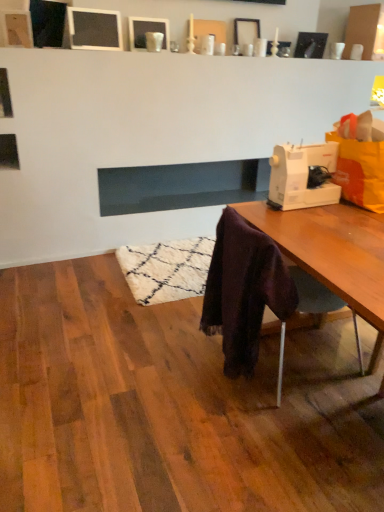
Question: From a real-world perspective, is dark glass fireplace at center physically above white plastic sewing machine at right?

Choices:
 (A) no
 (B) yes

Answer: (A)

Question: Is dark glass fireplace at center further to camera compared to white plastic sewing machine at right?

Choices:
 (A) yes
 (B) no

Answer: (A)

Question: Is dark glass fireplace at center to the right of white plastic sewing machine at right from the viewer's perspective?

Choices:
 (A) yes
 (B) no

Answer: (B)

Question: Does dark glass fireplace at center have a greater width compared to white plastic sewing machine at right?

Choices:
 (A) yes
 (B) no

Answer: (A)

Question: Is white plastic sewing machine at right at the back of dark glass fireplace at center?

Choices:
 (A) no
 (B) yes

Answer: (A)

Question: In terms of height, does dark glass fireplace at center look taller or shorter compared to matte white picture frame at upper center, which appears as the second picture frame when viewed from the right?

Choices:
 (A) short
 (B) tall

Answer: (B)

Question: Looking at the image, does dark glass fireplace at center seem bigger or smaller compared to matte white picture frame at upper center, positioned as the third picture frame in left-to-right order?

Choices:
 (A) big
 (B) small

Answer: (A)

Question: Visually, is dark glass fireplace at center positioned to the left or to the right of matte white picture frame at upper center, which appears as the second picture frame when viewed from the right?

Choices:
 (A) right
 (B) left

Answer: (B)

Question: Looking at their shapes, would you say dark glass fireplace at center is wider or thinner than matte white picture frame at upper center, positioned as the third picture frame in left-to-right order?

Choices:
 (A) thin
 (B) wide

Answer: (B)

Question: From their relative heights in the image, would you say matte black picture frame at upper center, which appears as the 4th picture frame when viewed from the right, is taller or shorter than velvet purple scarf at lower right?

Choices:
 (A) short
 (B) tall

Answer: (A)

Question: Relative to velvet purple scarf at lower right, is matte black picture frame at upper center, which appears as the 4th picture frame when viewed from the right, in front or behind?

Choices:
 (A) behind
 (B) front

Answer: (A)

Question: From the image's perspective, is matte black picture frame at upper center, which appears as the 4th picture frame when viewed from the right, located above or below velvet purple scarf at lower right?

Choices:
 (A) below
 (B) above

Answer: (B)

Question: Considering the positions of point (97, 24) and point (236, 224), is point (97, 24) closer or farther from the camera than point (236, 224)?

Choices:
 (A) closer
 (B) farther

Answer: (B)

Question: Looking at the image, does white plastic sewing machine at right seem bigger or smaller compared to matte white picture frame at upper center, which appears as the second picture frame when viewed from the left?

Choices:
 (A) small
 (B) big

Answer: (B)

Question: Is white plastic sewing machine at right inside the boundaries of matte white picture frame at upper center, which is the 3th picture frame from right to left, or outside?

Choices:
 (A) inside
 (B) outside

Answer: (B)